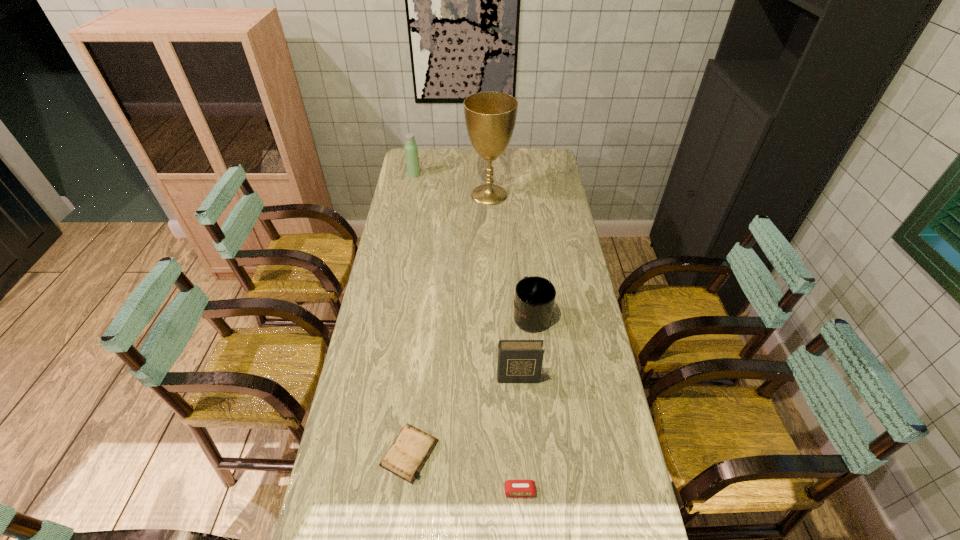
Where is `thermos bottle at the left edge`? thermos bottle at the left edge is located at coordinates (411, 150).

At what (x,y) coordinates should I click in order to perform the action: click on diary positioned at the left edge. Please return your answer as a coordinate pair (x, y). The width and height of the screenshot is (960, 540). Looking at the image, I should click on (405, 458).

This screenshot has width=960, height=540. I want to click on object located at the right edge, so [x=534, y=299].

The height and width of the screenshot is (540, 960). Identify the location of object situated at the far left corner. (411, 150).

At what (x,y) coordinates should I click in order to perform the action: click on vacant space at the far edge. Please return your answer as a coordinate pair (x, y). Looking at the image, I should click on (439, 163).

I want to click on vacant space at the left edge of the desktop, so click(345, 501).

At what (x,y) coordinates should I click in order to perform the action: click on free point at the right edge. Please return your answer as a coordinate pair (x, y). This screenshot has height=540, width=960. Looking at the image, I should click on (620, 444).

I want to click on vacant space at the far right corner of the desktop, so click(x=545, y=155).

Identify the location of free space that is in between the second tallest object and the tallest object. (451, 185).

Identify the location of free spot between the fifth nearest object and the shorter diary. (449, 324).